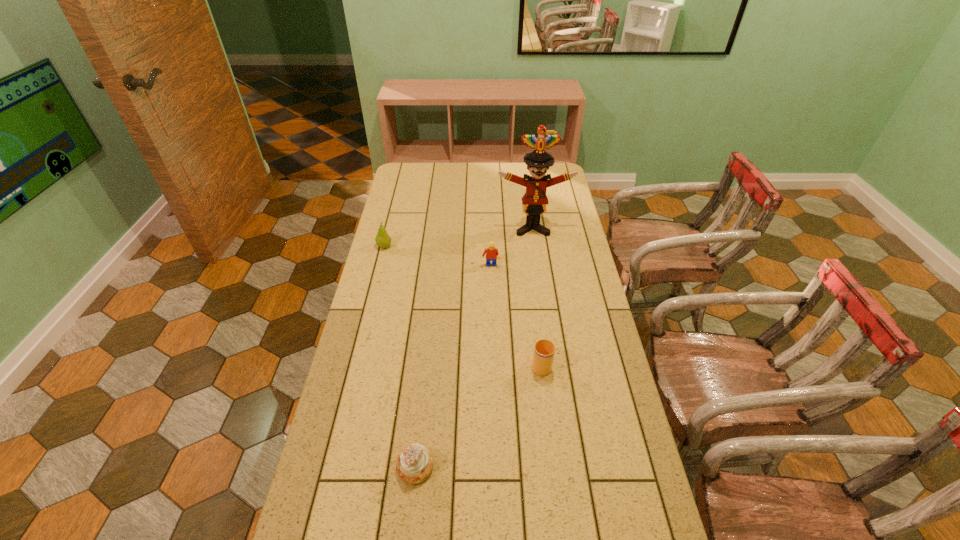
Identify the location of the tallest object. (534, 201).

Find the location of `the farthest object`. the farthest object is located at coordinates (534, 201).

Find the location of a particular element. the leftmost object is located at coordinates (383, 240).

At what (x,y) coordinates should I click in order to perform the action: click on pear. Please return your answer as a coordinate pair (x, y). This screenshot has height=540, width=960. Looking at the image, I should click on (383, 240).

Identify the location of Lego. The height and width of the screenshot is (540, 960). (491, 252).

This screenshot has width=960, height=540. In order to click on the fourth farthest object in this screenshot , I will do `click(544, 350)`.

Locate an element on the screen. This screenshot has height=540, width=960. the shortest object is located at coordinates (415, 463).

Locate an element on the screen. pastry is located at coordinates (415, 463).

Image resolution: width=960 pixels, height=540 pixels. I want to click on vacant area situated 0.340m on the front-facing side of the tallest object, so click(x=542, y=293).

Where is `vacant space located 0.130m on the front of the leftmost object`? vacant space located 0.130m on the front of the leftmost object is located at coordinates (377, 273).